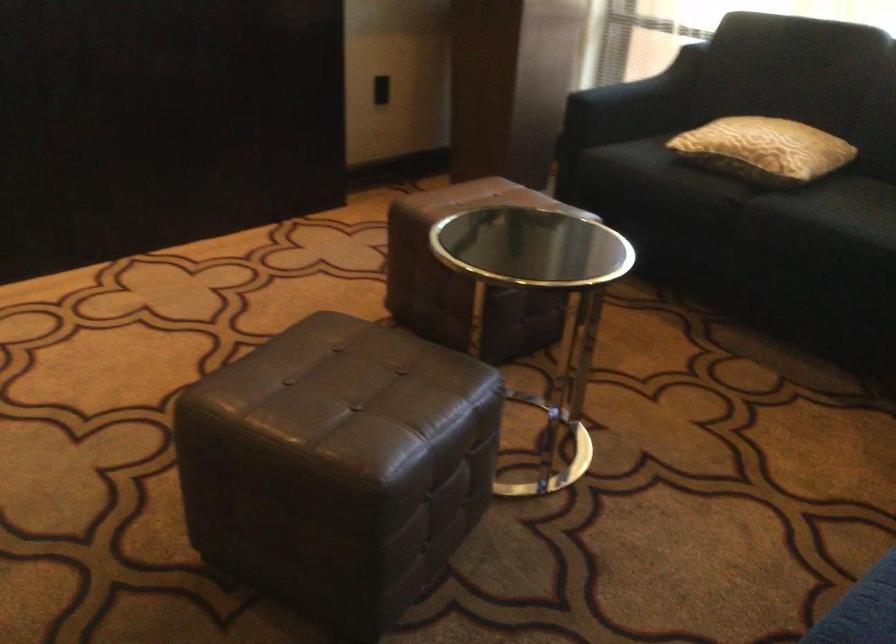
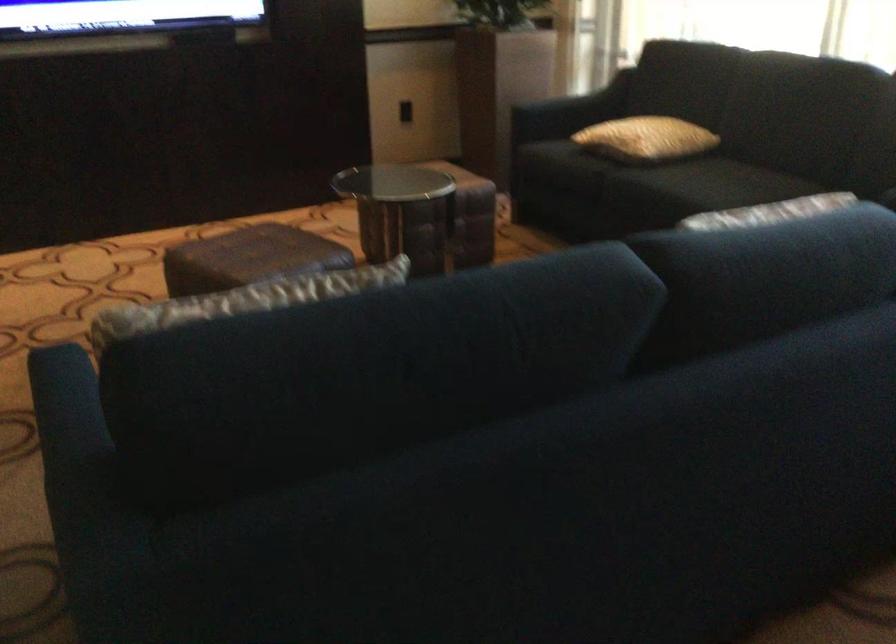
The point at (651, 89) is marked in the first image. Where is the corresponding point in the second image?

(586, 99)